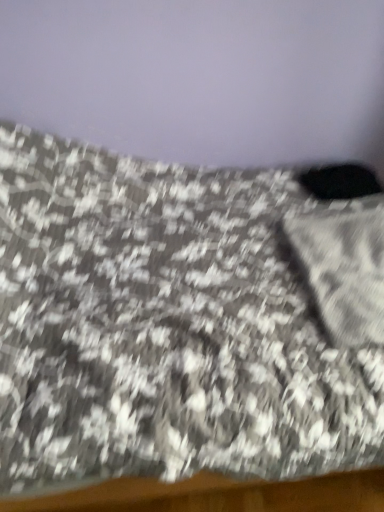
Find the location of a particular element. The image size is (384, 512). white speckled fabric at center is located at coordinates (342, 266).

The width and height of the screenshot is (384, 512). What do you see at coordinates (342, 266) in the screenshot?
I see `white speckled fabric at center` at bounding box center [342, 266].

You are a GUI agent. You are given a task and a screenshot of the screen. Output one action in this format:
    pyautogui.click(x=<x>, y=<y>)
    Task: Click on the white speckled fabric at center
    The width and height of the screenshot is (384, 512).
    Given the screenshot: What is the action you would take?
    pyautogui.click(x=342, y=266)